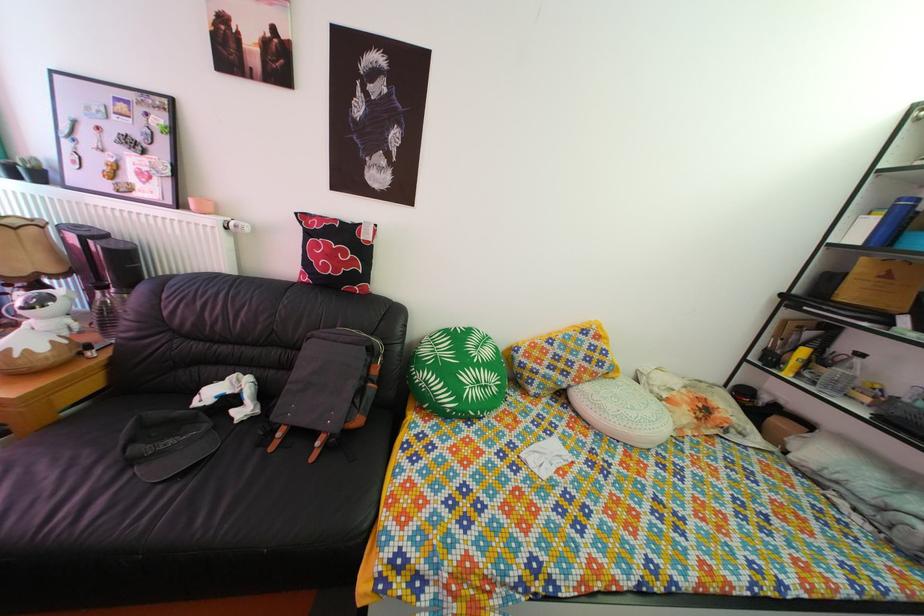
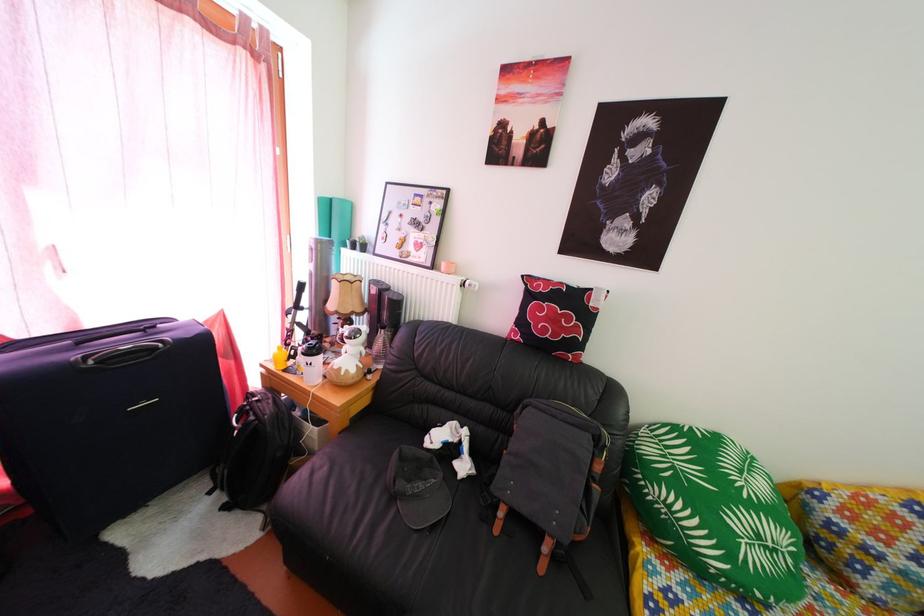
Find the pixel in the second image that matches [84,333] in the first image.

(372, 361)